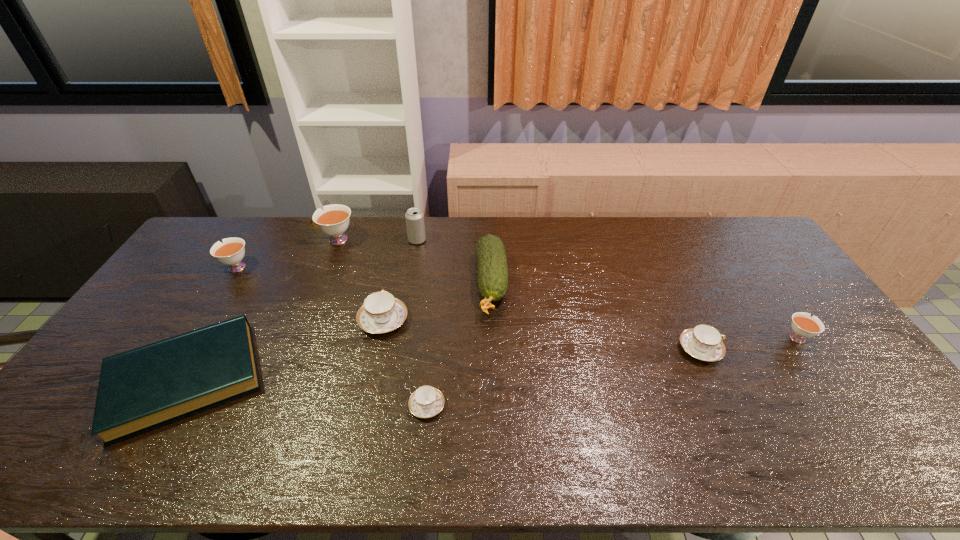
Find the location of a particular element. Image resolution: width=960 pixels, height=540 pixels. the rightmost white teacup is located at coordinates (804, 326).

Find the location of `the rightmost blue teacup`. the rightmost blue teacup is located at coordinates (703, 342).

Locate an element on the screen. This screenshot has width=960, height=540. the second object from right to left is located at coordinates (703, 342).

Locate an element on the screen. This screenshot has width=960, height=540. book is located at coordinates (147, 387).

Where is `the shortest teacup`? The height and width of the screenshot is (540, 960). the shortest teacup is located at coordinates (427, 401).

Identify the location of the smallest blue teacup. (427, 401).

Locate an element on the screen. free region located 0.400m on the right of the white beer can is located at coordinates (535, 240).

Image resolution: width=960 pixels, height=540 pixels. In order to click on free space located on the side of the biggest white teacup with the handle in this screenshot , I will do `click(269, 240)`.

You are a GUI agent. You are given a task and a screenshot of the screen. Output one action in this format:
    pyautogui.click(x=<x>, y=<y>)
    Task: Click on the vacant space situated on the side of the biggest white teacup with the handle
    The width and height of the screenshot is (960, 540).
    Given the screenshot: What is the action you would take?
    pyautogui.click(x=285, y=240)

Where is `free region located 0.300m on the side of the biggest white teacup with the handle`? free region located 0.300m on the side of the biggest white teacup with the handle is located at coordinates (233, 240).